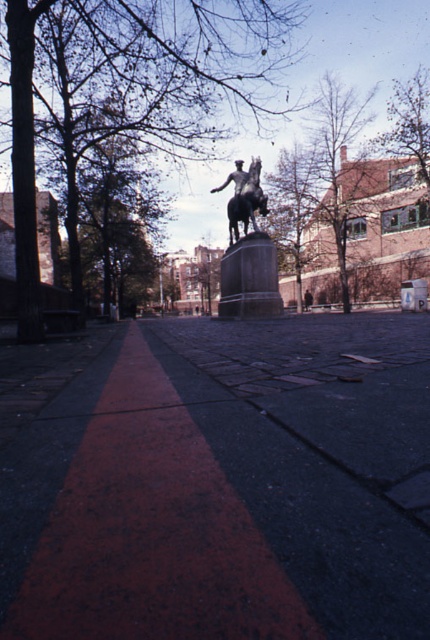
Is bronze statue at center above polished bronze statue at center?

Incorrect, bronze statue at center is not positioned above polished bronze statue at center.

Is point (226, 260) farther from viewer compared to point (261, 204)?

Yes, point (226, 260) is farther from viewer.

Does point (267, 312) lie behind point (246, 177)?

No, it is in front of (246, 177).

The height and width of the screenshot is (640, 430). Find the location of `bronze statue at center`. bronze statue at center is located at coordinates (248, 252).